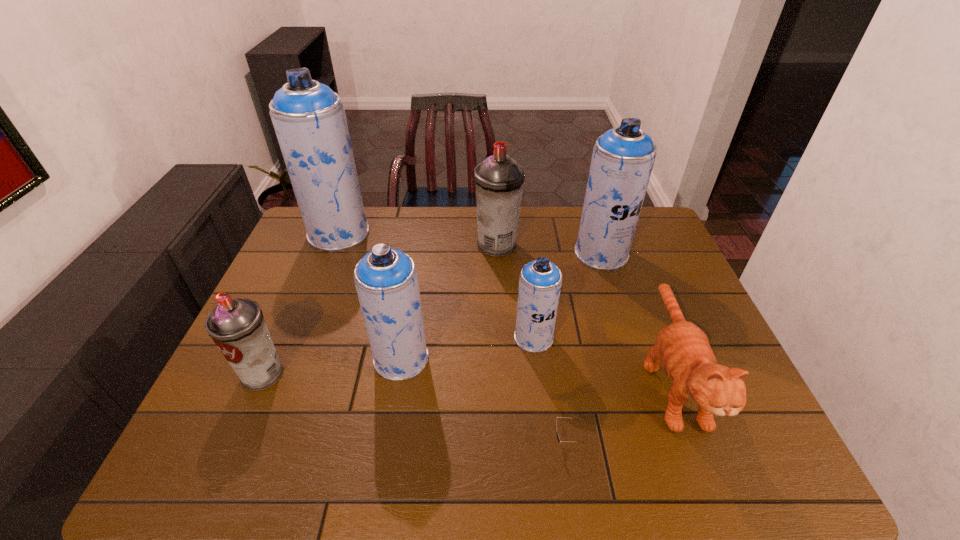
Identify the location of free region that satisfies the following two spatial constraints: 1. on the front side of the second blue aerosol can from right to left; 2. on the left side of the farther gray aerosol can. This screenshot has height=540, width=960. (501, 338).

In order to click on vacant region that satisfies the following two spatial constraints: 1. on the front side of the biggest blue aerosol can; 2. on the left side of the fifth shortest aerosol can in this screenshot , I will do `click(330, 253)`.

Find the location of `vacant space that satisfies the following two spatial constraints: 1. on the face of the cat; 2. in front of the lenses of the shortest object`. vacant space that satisfies the following two spatial constraints: 1. on the face of the cat; 2. in front of the lenses of the shortest object is located at coordinates (695, 441).